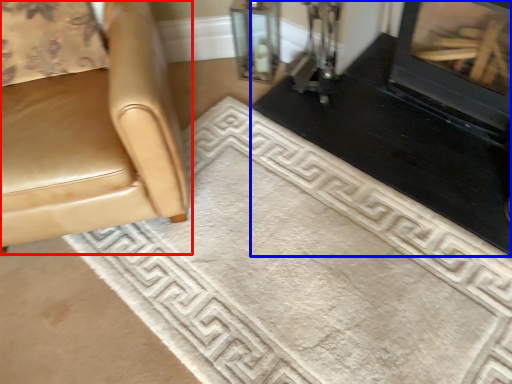
Question: Which point is closer to the camera, chair (highlighted by a red box) or fireplace (highlighted by a blue box)?

Choices:
 (A) chair
 (B) fireplace

Answer: (A)